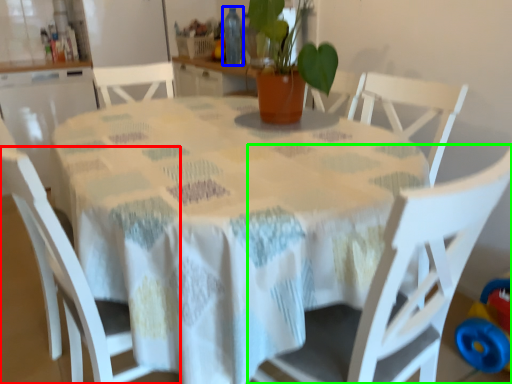
Question: Based on their relative distances, which object is nearer to chair (highlighted by a red box)? Choose from bottle (highlighted by a blue box) and chair (highlighted by a green box).

Choices:
 (A) bottle
 (B) chair

Answer: (B)